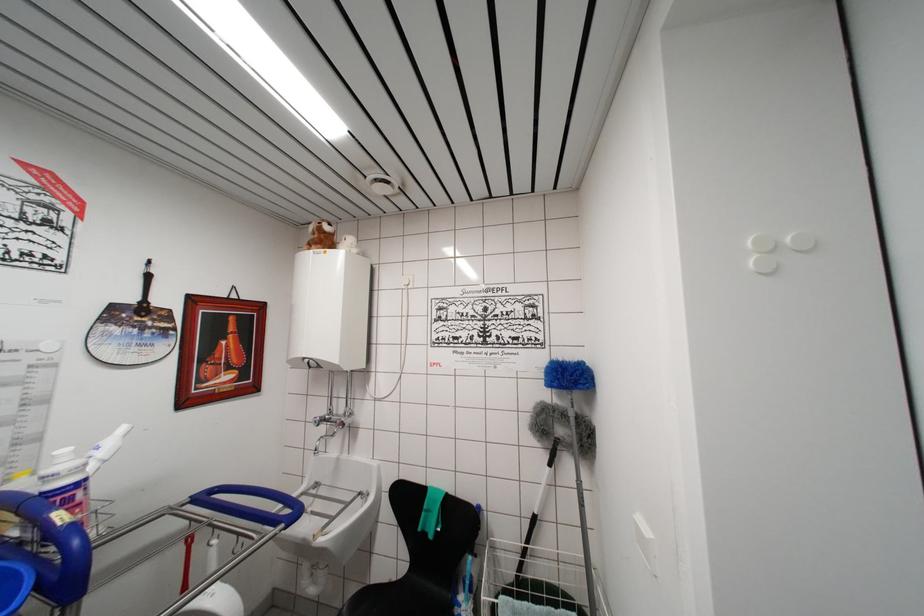
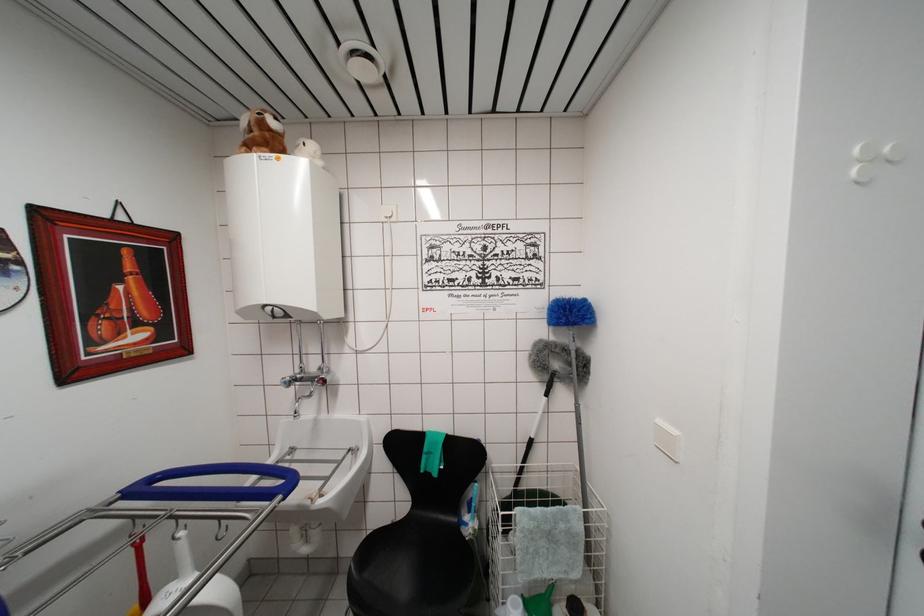
In a continuous first-person perspective shot, in which direction is the camera moving?

The cameraman walked toward left, forward.